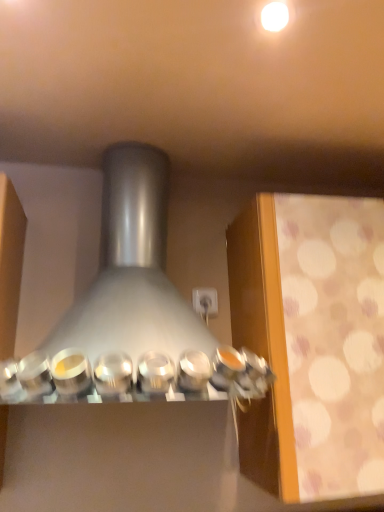
Question: Considering the positions of white glossy light bulb at upper center and satin silver range hood at center in the image, is white glossy light bulb at upper center bigger or smaller than satin silver range hood at center?

Choices:
 (A) big
 (B) small

Answer: (B)

Question: Is white glossy light bulb at upper center wider or thinner than satin silver range hood at center?

Choices:
 (A) thin
 (B) wide

Answer: (A)

Question: From their relative heights in the image, would you say white glossy light bulb at upper center is taller or shorter than satin silver range hood at center?

Choices:
 (A) short
 (B) tall

Answer: (A)

Question: From the image's perspective, relative to white glossy light bulb at upper center, is satin silver range hood at center above or below?

Choices:
 (A) below
 (B) above

Answer: (A)

Question: Is point (173, 348) positioned closer to the camera than point (264, 24)?

Choices:
 (A) farther
 (B) closer

Answer: (A)

Question: Is satin silver range hood at center inside or outside of white glossy light bulb at upper center?

Choices:
 (A) outside
 (B) inside

Answer: (A)

Question: Is satin silver range hood at center wider or thinner than white glossy light bulb at upper center?

Choices:
 (A) thin
 (B) wide

Answer: (B)